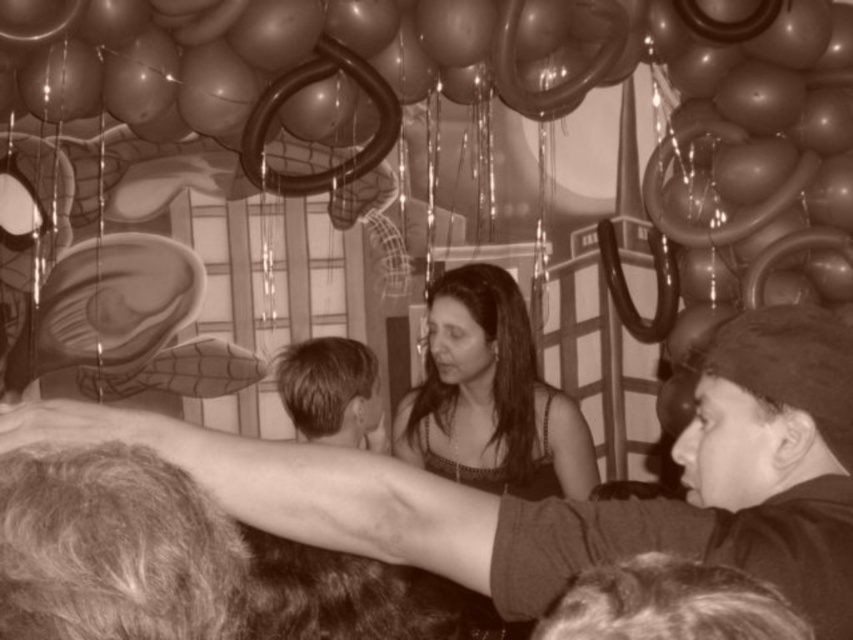
Which is above, matte black dress at center or dark brown hair at center?

matte black dress at center is above.

Is point (492, 401) positioned in front of point (331, 358)?

No, (492, 401) is further to viewer.

Which is behind, point (438, 300) or point (285, 396)?

The point (438, 300) is behind.

At what (x,y) coordinates should I click in order to perform the action: click on matte black dress at center. Please return your answer as a coordinate pair (x, y). The image size is (853, 640). Looking at the image, I should click on (490, 396).